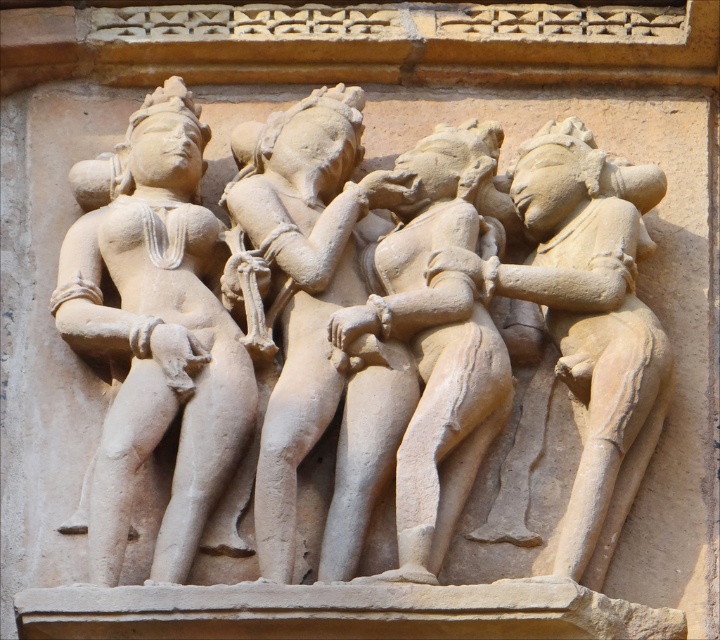
The image size is (720, 640). Describe the element at coordinates (153, 332) in the screenshot. I see `smooth beige statue at left` at that location.

At what (x,y) coordinates should I click in order to perform the action: click on smooth beige statue at left. Please return your answer as a coordinate pair (x, y). The width and height of the screenshot is (720, 640). Looking at the image, I should click on (153, 332).

Is beige stone sculpture at center further to the viewer compared to smooth beige statue at right?

A: No, beige stone sculpture at center is in front of smooth beige statue at right.

Is beige stone sculpture at center thinner than smooth beige statue at right?

No, beige stone sculpture at center is not thinner than smooth beige statue at right.

Is point (378, 376) farther from viewer compared to point (562, 566)?

That is True.

The height and width of the screenshot is (640, 720). Find the location of `beige stone sculpture at center`. beige stone sculpture at center is located at coordinates (441, 323).

Is point (162, 552) in front of point (426, 380)?

Yes, it is in front of point (426, 380).

Is point (109, 256) positioned after point (426, 531)?

That is True.

At what (x,y) coordinates should I click in order to perform the action: click on smooth beige statue at left. Please return your answer as a coordinate pair (x, y). The width and height of the screenshot is (720, 640). Looking at the image, I should click on (153, 332).